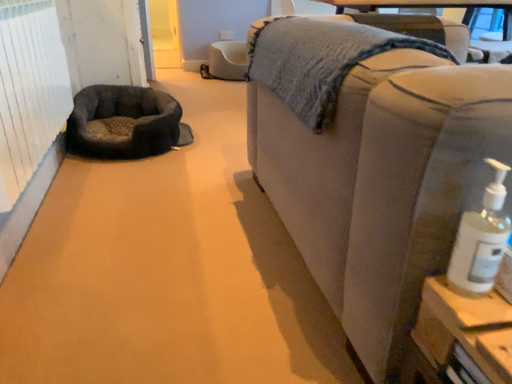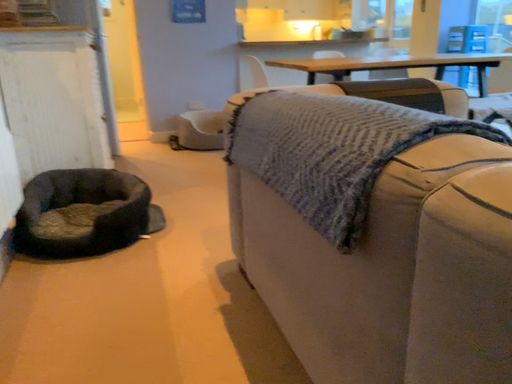
Question: How did the camera likely rotate when shooting the video?

Choices:
 (A) rotated upward
 (B) rotated downward

Answer: (A)